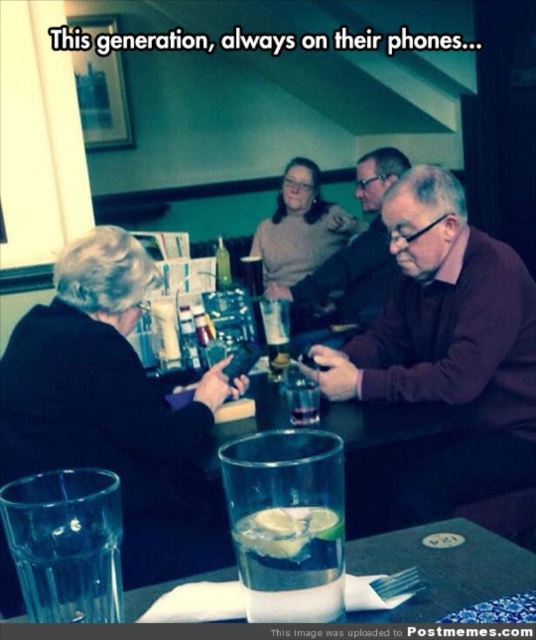
You are a waiter in a restaurant. You need to place a new menu on the table between the clear glass with lime slices at center and the green glass bottle at center. Which object should you move to make space?

The clear glass with lime slices at center is shorter than the green glass bottle at center, so you should move the shorter one, the clear glass with lime slices at center, to make space for the menu.

You are a customer sitting at the table and want to place your dark brown sweater at center on the table. Where exactly should you place it?

The dark brown sweater at center should be placed at the coordinates point (442,358).